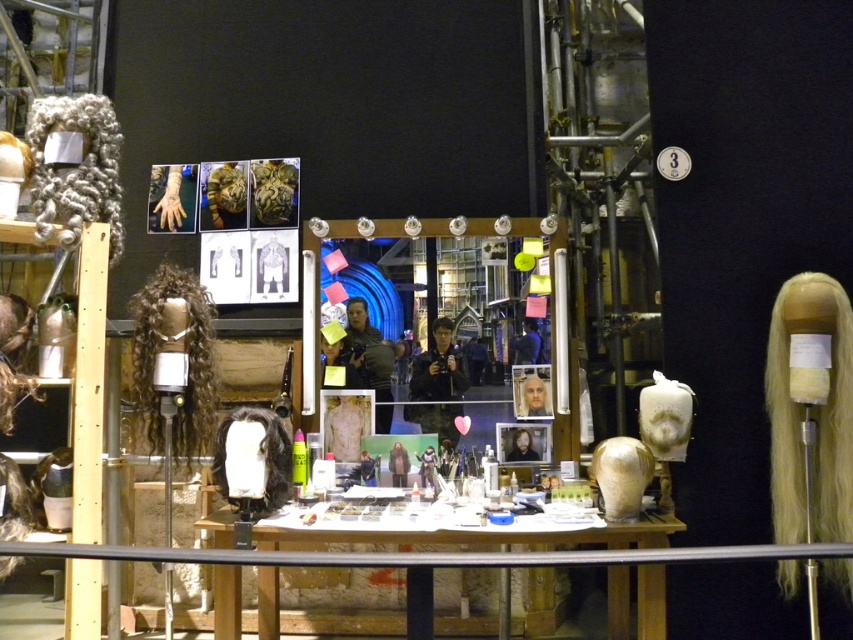
Does wooden table at center appear over black matte wig at center?

Actually, wooden table at center is below black matte wig at center.

Locate an element on the screen. The image size is (853, 640). wooden table at center is located at coordinates (483, 536).

Locate an element on the screen. The image size is (853, 640). wooden table at center is located at coordinates (483, 536).

Looking at this image, is wooden table at center smaller than curly brown wig at center?

Incorrect, wooden table at center is not smaller in size than curly brown wig at center.

Between point (547, 582) and point (187, 292), which one is positioned behind?

Point (547, 582)

Between point (616, 548) and point (163, 326), which one is positioned in front?

Point (616, 548) is more forward.

Identify the location of wooden table at center. The width and height of the screenshot is (853, 640). (483, 536).

Consider the image. Can you confirm if blonde synthetic wig at right is positioned below curly brown wig at center?

Yes.

Where is `blonde synthetic wig at right`? This screenshot has width=853, height=640. blonde synthetic wig at right is located at coordinates 817,428.